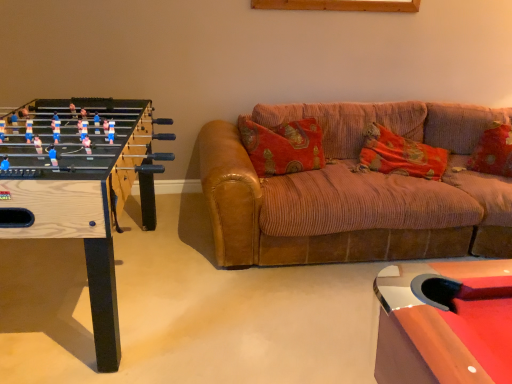
What do you see at coordinates (81, 187) in the screenshot?
I see `wooden foosball table at left` at bounding box center [81, 187].

This screenshot has height=384, width=512. What do you see at coordinates (493, 151) in the screenshot?
I see `velvet-like red pillow at right, which is the second pillow in left-to-right order` at bounding box center [493, 151].

Identify the location of orange corduroy pillow at center, the 2th pillow positioned from the right. This screenshot has height=384, width=512. (400, 155).

In order to click on brown corduroy couch at center in this screenshot , I will do `click(355, 191)`.

Is wooden foosball table at left spatially inside orange corduroy pillow at center, the 2th pillow positioned from the right, or outside of it?

wooden foosball table at left is not inside orange corduroy pillow at center, the 2th pillow positioned from the right, it's outside.

Which is behind, point (5, 146) or point (376, 150)?

Point (376, 150)

What are the coordinates of `pillow that is the 1st one when counting upward from the wooden foosball table at left (from the image's perspective)` in the screenshot? It's located at (400, 155).

Does wooden foosball table at left have a lesser width compared to orange corduroy pillow at center, the 2th pillow positioned from the right?

In fact, wooden foosball table at left might be wider than orange corduroy pillow at center, the 2th pillow positioned from the right.

Which is behind, brown corduroy couch at center or velvet-like red pillow at right, which is the second pillow in left-to-right order?

Positioned behind is velvet-like red pillow at right, which is the second pillow in left-to-right order.

From the picture: From a real-world perspective, which object stands above the other?

velvet-like red pillow at right, the first pillow viewed from the right, is physically above.

The width and height of the screenshot is (512, 384). I want to click on studio couch on the left side of velvet-like red pillow at right, which is the second pillow in left-to-right order, so click(x=355, y=191).

Can you confirm if brown corduroy couch at center is thinner than velvet-like red pillow at right, the first pillow viewed from the right?

In fact, brown corduroy couch at center might be wider than velvet-like red pillow at right, the first pillow viewed from the right.

Is wooden foosball table at left in front of velvet-like red pillow at right, the first pillow viewed from the right?

Yes, the depth of wooden foosball table at left is less than that of velvet-like red pillow at right, the first pillow viewed from the right.

Is wooden foosball table at left shorter than velvet-like red pillow at right, which is the second pillow in left-to-right order?

Incorrect, the height of wooden foosball table at left does not fall short of that of velvet-like red pillow at right, which is the second pillow in left-to-right order.

Are wooden foosball table at left and velvet-like red pillow at right, which is the second pillow in left-to-right order, located far from each other?

That's right, there is a large distance between wooden foosball table at left and velvet-like red pillow at right, which is the second pillow in left-to-right order.

Is brown corduroy couch at center bigger than orange corduroy pillow at center, the 1th pillow from the left?

Indeed, brown corduroy couch at center has a larger size compared to orange corduroy pillow at center, the 1th pillow from the left.

Locate an element on the screen. The height and width of the screenshot is (384, 512). pillow that is the 1st object located above the brown corduroy couch at center (from the image's perspective) is located at coordinates (400, 155).

Could you tell me if brown corduroy couch at center is facing orange corduroy pillow at center, the 2th pillow positioned from the right?

Yes, brown corduroy couch at center is aimed at orange corduroy pillow at center, the 2th pillow positioned from the right.

From the image's perspective, is brown corduroy couch at center on wooden foosball table at left?

Yes, from the image's perspective, brown corduroy couch at center is on top of wooden foosball table at left.

Considering the sizes of brown corduroy couch at center and wooden foosball table at left in the image, is brown corduroy couch at center taller or shorter than wooden foosball table at left?

Considering their sizes, brown corduroy couch at center has less height than wooden foosball table at left.

Considering the relative sizes of brown corduroy couch at center and wooden foosball table at left in the image provided, is brown corduroy couch at center wider than wooden foosball table at left?

Yes.

Can you confirm if brown corduroy couch at center is positioned to the left of wooden foosball table at left?

In fact, brown corduroy couch at center is to the right of wooden foosball table at left.

Identify the location of pillow below the velvet-like red pillow at right, the first pillow viewed from the right (from a real-world perspective). The width and height of the screenshot is (512, 384). (400, 155).

Are velvet-like red pillow at right, the first pillow viewed from the right, and orange corduroy pillow at center, the 2th pillow positioned from the right, making contact?

No, velvet-like red pillow at right, the first pillow viewed from the right, is not beside orange corduroy pillow at center, the 2th pillow positioned from the right.

Between velvet-like red pillow at right, the first pillow viewed from the right, and orange corduroy pillow at center, the 1th pillow from the left, which one has smaller width?

velvet-like red pillow at right, the first pillow viewed from the right, is thinner.

Considering the positions of point (409, 153) and point (506, 165), is point (409, 153) closer or farther from the camera than point (506, 165)?

Point (409, 153) is farther from the camera than point (506, 165).

From a real-world perspective, is orange corduroy pillow at center, the 2th pillow positioned from the right, positioned above or below velvet-like red pillow at right, the first pillow viewed from the right?

orange corduroy pillow at center, the 2th pillow positioned from the right, is below velvet-like red pillow at right, the first pillow viewed from the right.

Can you confirm if orange corduroy pillow at center, the 2th pillow positioned from the right, is wider than velvet-like red pillow at right, the first pillow viewed from the right?

Indeed, orange corduroy pillow at center, the 2th pillow positioned from the right, has a greater width compared to velvet-like red pillow at right, the first pillow viewed from the right.

Image resolution: width=512 pixels, height=384 pixels. I want to click on the 1st pillow behind when counting from the wooden foosball table at left, so click(x=400, y=155).

At what (x,y) coordinates should I click in order to perform the action: click on studio couch below the velvet-like red pillow at right, which is the second pillow in left-to-right order (from the image's perspective). Please return your answer as a coordinate pair (x, y). Looking at the image, I should click on (355, 191).

When comparing their distances from velvet-like red pillow at right, which is the second pillow in left-to-right order, does orange corduroy pillow at center, the 2th pillow positioned from the right, or brown corduroy couch at center seem closer?

Among the two, orange corduroy pillow at center, the 2th pillow positioned from the right, is located nearer to velvet-like red pillow at right, which is the second pillow in left-to-right order.

Looking at the image, which one is located closer to orange corduroy pillow at center, the 2th pillow positioned from the right, wooden foosball table at left or brown corduroy couch at center?

brown corduroy couch at center lies closer to orange corduroy pillow at center, the 2th pillow positioned from the right, than the other object.

When comparing their distances from velvet-like red pillow at right, which is the second pillow in left-to-right order, does brown corduroy couch at center or orange corduroy pillow at center, the 1th pillow from the left, seem further?

brown corduroy couch at center lies further to velvet-like red pillow at right, which is the second pillow in left-to-right order, than the other object.

Which object lies nearer to the anchor point velvet-like red pillow at right, the first pillow viewed from the right, brown corduroy couch at center or wooden foosball table at left?

brown corduroy couch at center lies closer to velvet-like red pillow at right, the first pillow viewed from the right, than the other object.

When comparing their distances from orange corduroy pillow at center, the 1th pillow from the left, does wooden foosball table at left or velvet-like red pillow at right, which is the second pillow in left-to-right order, seem further?

Among the two, wooden foosball table at left is located further to orange corduroy pillow at center, the 1th pillow from the left.

Estimate the real-world distances between objects in this image. Which object is closer to wooden foosball table at left, brown corduroy couch at center or velvet-like red pillow at right, which is the second pillow in left-to-right order?

Based on the image, brown corduroy couch at center appears to be nearer to wooden foosball table at left.

Looking at the image, which one is located closer to wooden foosball table at left, velvet-like red pillow at right, which is the second pillow in left-to-right order, or orange corduroy pillow at center, the 2th pillow positioned from the right?

Based on the image, orange corduroy pillow at center, the 2th pillow positioned from the right, appears to be nearer to wooden foosball table at left.

From the image, which object appears to be nearer to orange corduroy pillow at center, the 2th pillow positioned from the right, velvet-like red pillow at right, which is the second pillow in left-to-right order, or brown corduroy couch at center?

brown corduroy couch at center lies closer to orange corduroy pillow at center, the 2th pillow positioned from the right, than the other object.

In order to click on pillow positioned between brown corduroy couch at center and velvet-like red pillow at right, the first pillow viewed from the right, from near to far in this screenshot , I will do `click(400, 155)`.

This screenshot has height=384, width=512. What are the coordinates of `pillow situated between wooden foosball table at left and brown corduroy couch at center from left to right` in the screenshot? It's located at (400, 155).

Locate an element on the screen. Image resolution: width=512 pixels, height=384 pixels. studio couch situated between wooden foosball table at left and velvet-like red pillow at right, the first pillow viewed from the right, from left to right is located at coordinates (355, 191).

The image size is (512, 384). I want to click on pillow between wooden foosball table at left and velvet-like red pillow at right, which is the second pillow in left-to-right order, so click(x=400, y=155).